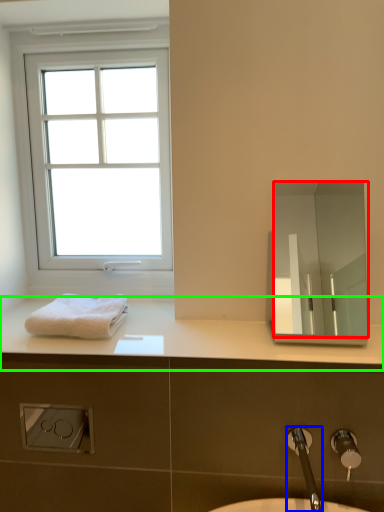
Question: Which object is the farthest from mirror (highlighted by a red box)? Choose among these: tap (highlighted by a blue box) or counter top (highlighted by a green box).

Choices:
 (A) tap
 (B) counter top

Answer: (A)